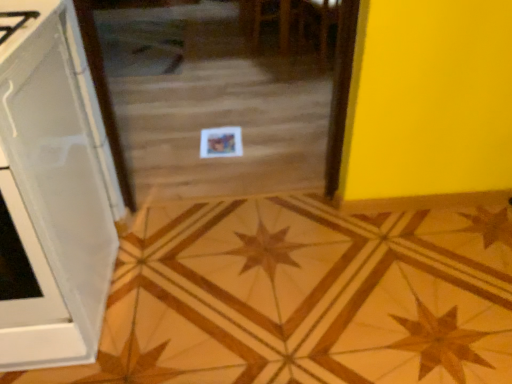
Locate an element on the screen. This screenshot has width=512, height=384. transparent glass door at center is located at coordinates (220, 92).

Locate an element on the screen. This screenshot has width=512, height=384. wooden star at center is located at coordinates (304, 296).

Find the location of `transparent glass door at center`. transparent glass door at center is located at coordinates (220, 92).

Can you confirm if transparent glass door at center is smaller than white glossy cabinet at left?

Actually, transparent glass door at center might be larger than white glossy cabinet at left.

Considering the sizes of transparent glass door at center and white glossy cabinet at left in the image, is transparent glass door at center taller or shorter than white glossy cabinet at left?

In the image, transparent glass door at center appears to be shorter than white glossy cabinet at left.

Which object is closer to the camera, transparent glass door at center or white glossy cabinet at left?

white glossy cabinet at left is in front.

Do you think transparent glass door at center is within white glossy cabinet at left, or outside of it?

The correct answer is: outside.

Can you confirm if white glossy cabinet at left is positioned to the right of wooden star at center?

Incorrect, white glossy cabinet at left is not on the right side of wooden star at center.

Would you say white glossy cabinet at left contains wooden star at center?

No, white glossy cabinet at left does not contain wooden star at center.

Considering the relative positions of white glossy cabinet at left and transparent glass door at center in the image provided, is white glossy cabinet at left to the left or to the right of transparent glass door at center?

In the image, white glossy cabinet at left appears on the left side of transparent glass door at center.

In terms of size, does white glossy cabinet at left appear bigger or smaller than transparent glass door at center?

Considering their sizes, white glossy cabinet at left takes up less space than transparent glass door at center.

From a real-world perspective, is white glossy cabinet at left physically below transparent glass door at center?

No, from a real-world perspective, white glossy cabinet at left is not below transparent glass door at center.

Between white glossy cabinet at left and transparent glass door at center, which one has smaller width?

white glossy cabinet at left.

Based on the photo, is transparent glass door at center in contact with wooden star at center?

No, transparent glass door at center is not with wooden star at center.

Considering the sizes of objects transparent glass door at center and wooden star at center in the image provided, who is taller, transparent glass door at center or wooden star at center?

transparent glass door at center.

From a real-world perspective, between transparent glass door at center and wooden star at center, who is vertically higher?

In real-world perspective, transparent glass door at center is above.

Would you say transparent glass door at center is inside or outside wooden star at center?

transparent glass door at center exists outside the volume of wooden star at center.

Does point (362, 266) appear closer or farther from the camera than point (12, 320)?

Point (362, 266).

From the image's perspective, is wooden star at center on white glossy cabinet at left?

No.

Is the surface of wooden star at center in direct contact with white glossy cabinet at left?

No, wooden star at center is not next to white glossy cabinet at left.

How many degrees apart are the facing directions of wooden star at center and white glossy cabinet at left?

wooden star at center and white glossy cabinet at left are facing 0.16 degrees away from each other.

Is wooden star at center wider than transparent glass door at center?

Incorrect, the width of wooden star at center does not surpass that of transparent glass door at center.

Who is shorter, wooden star at center or transparent glass door at center?

With less height is wooden star at center.

Are wooden star at center and transparent glass door at center far apart?

wooden star at center is far away from transparent glass door at center.

In the scene shown: Is wooden star at center inside the boundaries of transparent glass door at center, or outside?

wooden star at center is located beyond the bounds of transparent glass door at center.

At what (x,y) coordinates should I click in order to perform the action: click on glass door that is on the right side of white glossy cabinet at left. Please return your answer as a coordinate pair (x, y). Looking at the image, I should click on (220, 92).

Identify the location of ceramic tile lying behind the white glossy cabinet at left. (304, 296).

Estimate the real-world distances between objects in this image. Which object is closer to transparent glass door at center, white glossy cabinet at left or wooden star at center?

wooden star at center is positioned closer to the anchor transparent glass door at center.

From the picture: Estimate the real-world distances between objects in this image. Which object is further from wooden star at center, white glossy cabinet at left or transparent glass door at center?

The object further to wooden star at center is transparent glass door at center.

Considering their positions, is transparent glass door at center positioned closer to white glossy cabinet at left than wooden star at center?

wooden star at center lies closer to white glossy cabinet at left than the other object.

From the image, which object appears to be farther from white glossy cabinet at left, wooden star at center or transparent glass door at center?

transparent glass door at center.

Looking at the image, which one is located further to transparent glass door at center, wooden star at center or white glossy cabinet at left?

Among the two, white glossy cabinet at left is located further to transparent glass door at center.

From the image, which object appears to be nearer to wooden star at center, transparent glass door at center or white glossy cabinet at left?

The object closer to wooden star at center is white glossy cabinet at left.

I want to click on cabinetry between transparent glass door at center and wooden star at center vertically, so click(x=52, y=191).